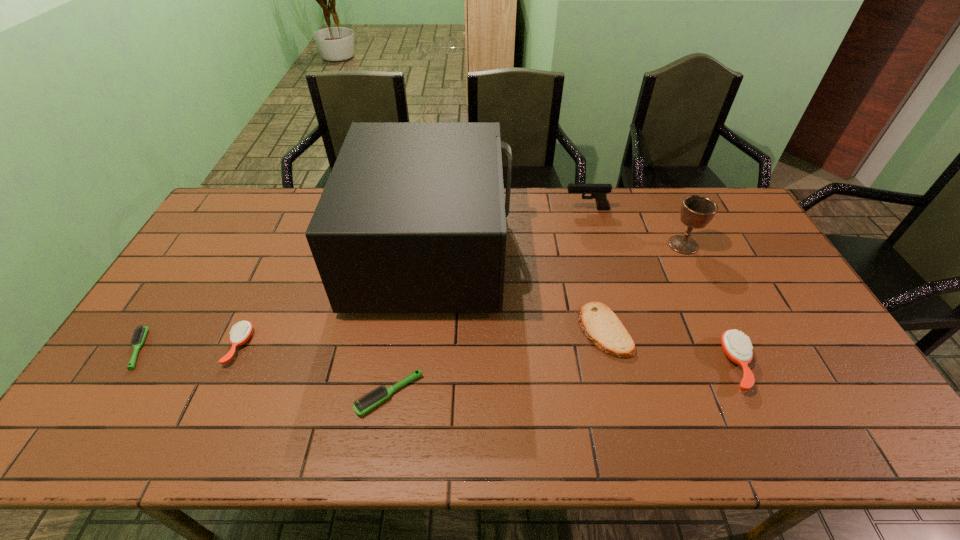
Locate an element on the screen. The width and height of the screenshot is (960, 540). the smaller light hairbrush is located at coordinates 139,335.

Where is `the farther light hairbrush`? The width and height of the screenshot is (960, 540). the farther light hairbrush is located at coordinates (139, 335).

You are a GUI agent. You are given a task and a screenshot of the screen. Output one action in this format:
    pyautogui.click(x=<x>, y=<y>)
    Task: Click on the vacant space situated 0.300m on the front-facing side of the microwave oven
    This screenshot has height=540, width=960.
    Given the screenshot: What is the action you would take?
    pyautogui.click(x=602, y=252)

Locate an element on the screen. The height and width of the screenshot is (540, 960). vacant space situated on the back of the chalice is located at coordinates (671, 220).

Locate an element on the screen. The width and height of the screenshot is (960, 540). free space located on the front-facing side of the sixth shortest object is located at coordinates (550, 209).

Locate an element on the screen. The width and height of the screenshot is (960, 540). vacant area situated 0.080m on the front-facing side of the sixth shortest object is located at coordinates (541, 209).

Find the location of a particular element. blank space located 0.370m on the front-facing side of the sixth shortest object is located at coordinates (462, 209).

Where is `free space located 0.140m on the left of the fourth tallest object`? This screenshot has height=540, width=960. free space located 0.140m on the left of the fourth tallest object is located at coordinates (669, 364).

This screenshot has height=540, width=960. Identify the location of free space located 0.210m on the left of the second object from left to right. (152, 346).

Where is `free space located 0.270m on the right of the pita bread`? This screenshot has width=960, height=540. free space located 0.270m on the right of the pita bread is located at coordinates (727, 330).